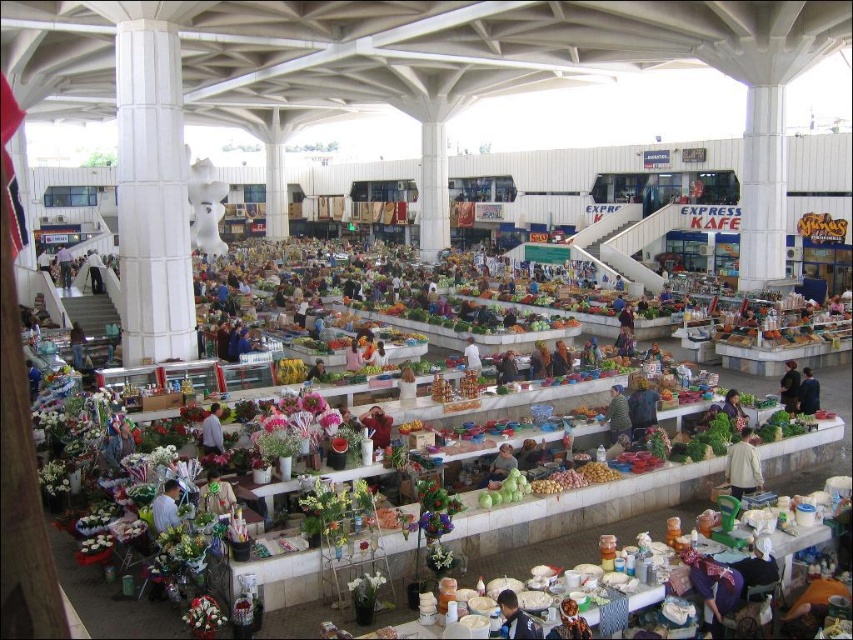
From the picture: Does blue fabric shirt at center appear under smooth beige shirt at center?

Indeed, blue fabric shirt at center is positioned under smooth beige shirt at center.

Can you confirm if blue fabric shirt at center is shorter than smooth beige shirt at center?

No, blue fabric shirt at center is not shorter than smooth beige shirt at center.

Measure the distance between blue fabric shirt at center and camera.

blue fabric shirt at center and camera are 35.28 meters apart.

This screenshot has width=853, height=640. What are the coordinates of `blue fabric shirt at center` in the screenshot? It's located at (166, 508).

Is red shirt at center bigger than dark brown leather jacket at center?

Actually, red shirt at center might be smaller than dark brown leather jacket at center.

Which is more to the right, red shirt at center or dark brown leather jacket at center?

dark brown leather jacket at center

Is point (384, 432) more distant than point (744, 419)?

No, it is not.

This screenshot has width=853, height=640. I want to click on red shirt at center, so click(x=376, y=426).

Is white matte flower at lower left thinner than light blue shirt at center?

No.

Does white matte flower at lower left appear on the right side of light blue shirt at center?

Indeed, white matte flower at lower left is positioned on the right side of light blue shirt at center.

Measure the distance between white matte flower at lower left and camera.

104.12 feet

Where is `white matte flower at lower left`? The width and height of the screenshot is (853, 640). white matte flower at lower left is located at coordinates (202, 616).